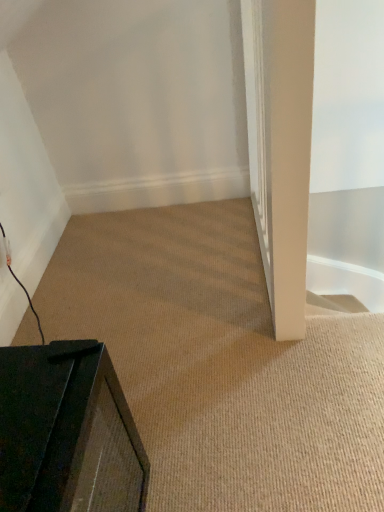
Question: Is black matte speaker at lower left not inside black matte tv at lower left?

Choices:
 (A) yes
 (B) no

Answer: (A)

Question: From a real-world perspective, is black matte speaker at lower left on black matte tv at lower left?

Choices:
 (A) no
 (B) yes

Answer: (B)

Question: Is the depth of black matte speaker at lower left greater than that of black matte tv at lower left?

Choices:
 (A) yes
 (B) no

Answer: (B)

Question: Can you confirm if black matte speaker at lower left is positioned to the left of black matte tv at lower left?

Choices:
 (A) yes
 (B) no

Answer: (A)

Question: Is black matte speaker at lower left shorter than black matte tv at lower left?

Choices:
 (A) no
 (B) yes

Answer: (A)

Question: Is black matte speaker at lower left positioned far away from black matte tv at lower left?

Choices:
 (A) yes
 (B) no

Answer: (B)

Question: Is white smooth pillar at right bigger than black matte tv at lower left?

Choices:
 (A) yes
 (B) no

Answer: (A)

Question: Can we say white smooth pillar at right lies outside black matte tv at lower left?

Choices:
 (A) no
 (B) yes

Answer: (B)

Question: Is black matte tv at lower left a part of white smooth pillar at right?

Choices:
 (A) yes
 (B) no

Answer: (B)

Question: Does white smooth pillar at right have a lesser height compared to black matte tv at lower left?

Choices:
 (A) yes
 (B) no

Answer: (B)

Question: From a real-world perspective, does white smooth pillar at right stand above black matte tv at lower left?

Choices:
 (A) yes
 (B) no

Answer: (A)

Question: Would you consider white smooth pillar at right to be distant from black matte tv at lower left?

Choices:
 (A) no
 (B) yes

Answer: (A)

Question: Can you confirm if black matte tv at lower left is shorter than black matte speaker at lower left?

Choices:
 (A) yes
 (B) no

Answer: (A)